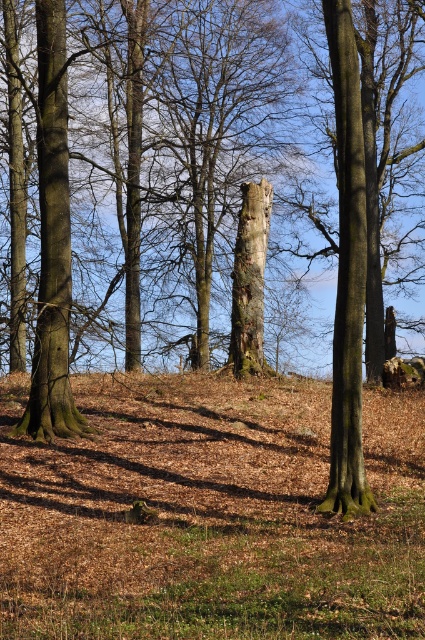
Question: Which of the following is the closest to the observer?

Choices:
 (A) smooth brown tree trunk at left
 (B) smooth brown tree trunk at right

Answer: (B)

Question: Which of the following is the closest to the observer?

Choices:
 (A) smooth brown tree trunk at center
 (B) smooth brown tree trunk at right
 (C) smooth brown tree trunk at left

Answer: (B)

Question: Does smooth brown tree trunk at right appear on the left side of smooth brown tree trunk at left?

Choices:
 (A) no
 (B) yes

Answer: (A)

Question: Does smooth brown tree trunk at right have a greater width compared to smooth brown tree trunk at left?

Choices:
 (A) no
 (B) yes

Answer: (B)

Question: Among these points, which one is nearest to the camera?

Choices:
 (A) (342, 227)
 (B) (257, 353)
 (C) (45, 129)

Answer: (A)

Question: Is smooth brown tree trunk at right below smooth brown tree trunk at center?

Choices:
 (A) yes
 (B) no

Answer: (B)